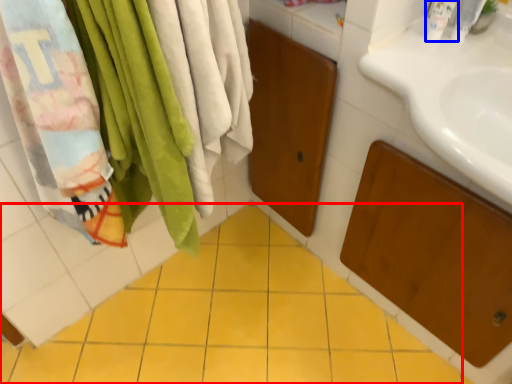
Question: Which of the following is the closest to the observer, ceramic tile (highlighted by a red box) or toiletry (highlighted by a blue box)?

Choices:
 (A) ceramic tile
 (B) toiletry

Answer: (A)